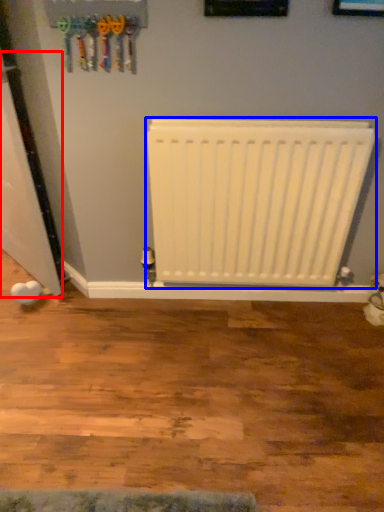
Question: Which point is further to the camera, door (highlighted by a red box) or radiator (highlighted by a blue box)?

Choices:
 (A) door
 (B) radiator

Answer: (B)